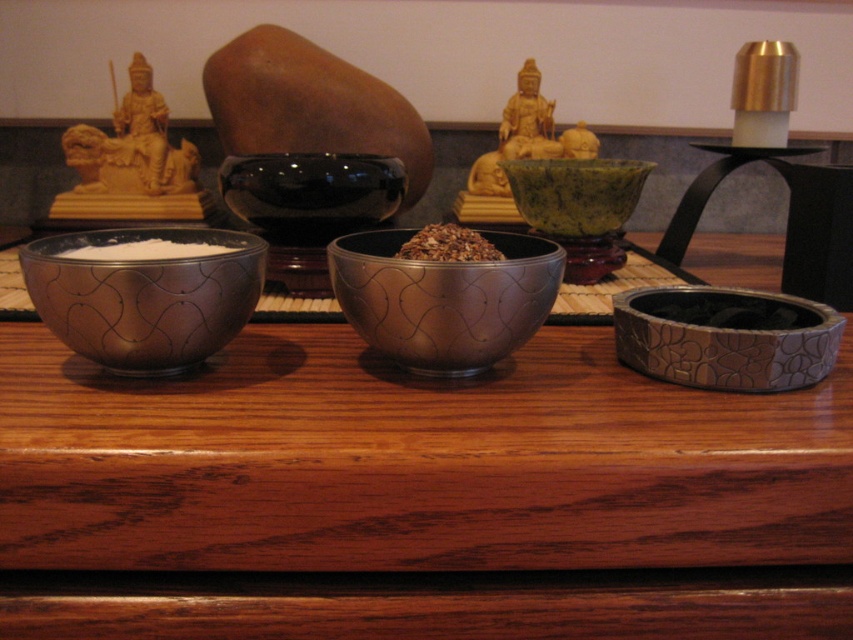
Does glossy ceramic bowl at center appear on the left side of brown textured rice at center?

Yes, glossy ceramic bowl at center is to the left of brown textured rice at center.

The width and height of the screenshot is (853, 640). What do you see at coordinates (309, 205) in the screenshot? I see `glossy ceramic bowl at center` at bounding box center [309, 205].

Between point (258, 218) and point (479, 237), which one is positioned behind?

Positioned behind is point (258, 218).

Locate an element on the screen. The image size is (853, 640). glossy ceramic bowl at center is located at coordinates (309, 205).

In the scene shown: Does metallic silver bowl at center have a lesser width compared to green marble bowl at center?

Correct, metallic silver bowl at center's width is less than green marble bowl at center's.

In order to click on metallic silver bowl at center in this screenshot , I will do `click(444, 298)`.

Where is `metallic silver bowl at center`? Image resolution: width=853 pixels, height=640 pixels. metallic silver bowl at center is located at coordinates (444, 298).

Is metallic silver bowl at center wider than white powder at left?

Yes, metallic silver bowl at center is wider than white powder at left.

Between point (489, 336) and point (183, 250), which one is positioned in front?

Point (489, 336) is in front.

Is point (537, 301) positioned behind point (125, 257)?

No, (537, 301) is closer to viewer.

Identify the location of metallic silver bowl at center. This screenshot has width=853, height=640. (444, 298).